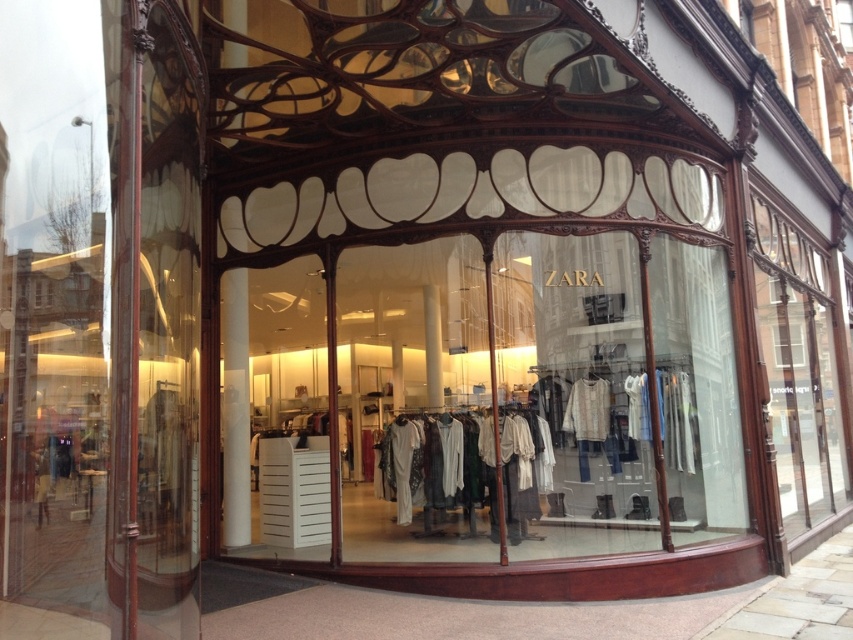
Question: Considering the real-world distances, which object is closest to the clear glass window at upper right?

Choices:
 (A) wooden frame at center
 (B) white cotton shirts at center

Answer: (A)

Question: Which is farther from the clear glass window at upper right?

Choices:
 (A) white cotton shirts at center
 (B) wooden frame at center

Answer: (A)

Question: Does wooden frame at center have a larger size compared to white cotton shirts at center?

Choices:
 (A) yes
 (B) no

Answer: (A)

Question: Among these points, which one is farthest from the camera?

Choices:
 (A) (788, 340)
 (B) (462, 417)
 (C) (517, 561)

Answer: (A)

Question: Can you confirm if wooden frame at center is positioned to the left of white cotton shirts at center?

Choices:
 (A) yes
 (B) no

Answer: (A)

Question: Does wooden frame at center have a smaller size compared to white cotton shirts at center?

Choices:
 (A) yes
 (B) no

Answer: (B)